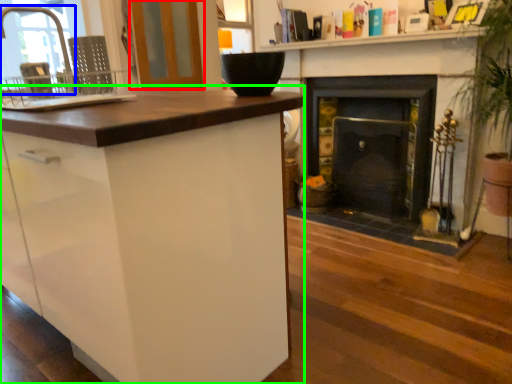
Question: Which object is positioned closest to screen door (highlighted by a red box)? Select from faucet (highlighted by a blue box) and cabinetry (highlighted by a green box).

Choices:
 (A) faucet
 (B) cabinetry

Answer: (A)